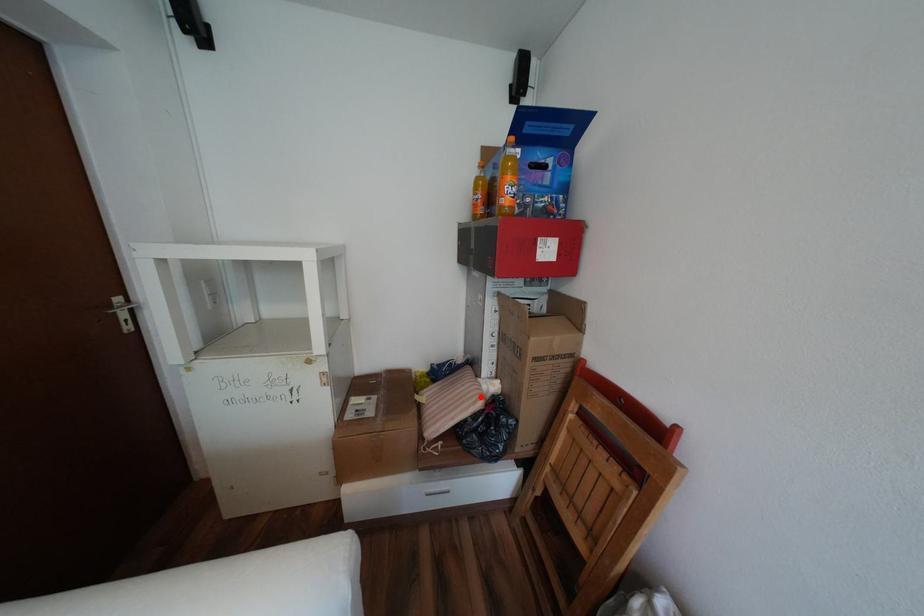
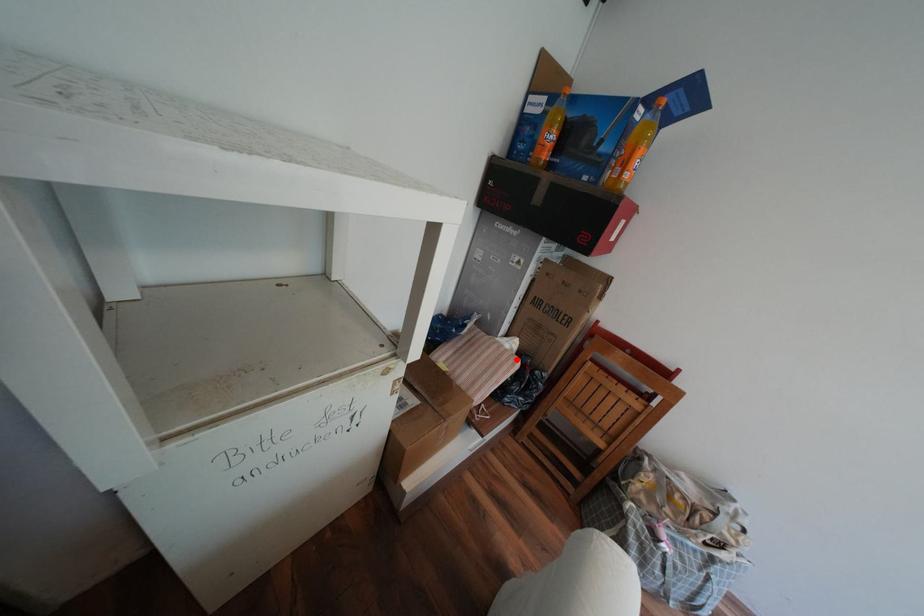
I am providing you with two images of the same scene from different viewpoints. A red point is marked on the first image and another point is marked on the second image. Is the red point in image1 aligned with the point shown in image2?

Yes